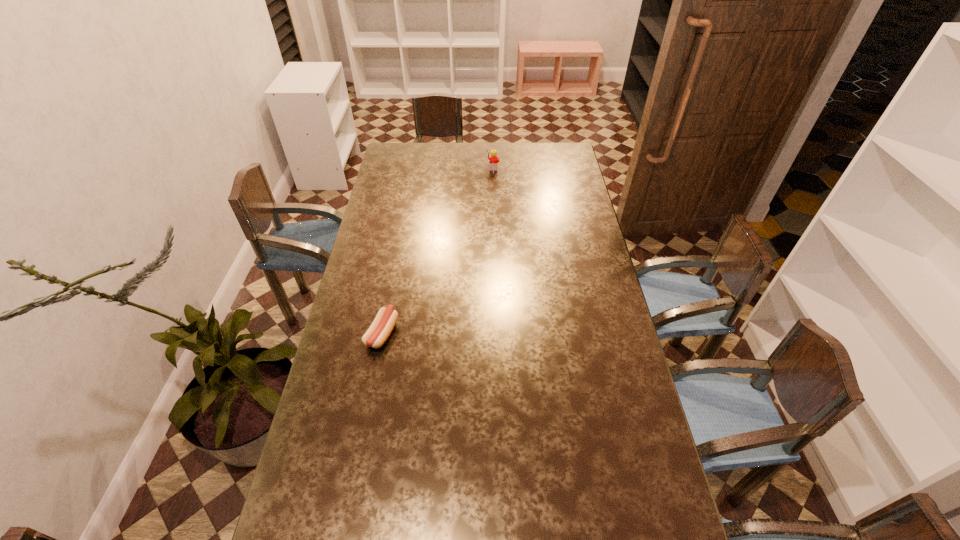
The height and width of the screenshot is (540, 960). I want to click on the taller object, so click(493, 159).

Identify the location of the farther object. This screenshot has height=540, width=960. (493, 159).

I want to click on sausage, so click(379, 331).

Where is `the nearer object`? The image size is (960, 540). the nearer object is located at coordinates (379, 331).

Where is `free spot located 0.400m in front of the right object with the accessory visible`? This screenshot has height=540, width=960. free spot located 0.400m in front of the right object with the accessory visible is located at coordinates pos(403,167).

This screenshot has width=960, height=540. I want to click on vacant space situated 0.230m in front of the right object with the accessory visible, so click(439, 167).

In order to click on vacant area located 0.160m in front of the right object with the accessory visible in this screenshot , I will do `click(453, 167)`.

Image resolution: width=960 pixels, height=540 pixels. What are the coordinates of `vacant region located 0.090m on the left of the left object` in the screenshot? It's located at (339, 333).

Where is `object that is at the far edge`? The width and height of the screenshot is (960, 540). object that is at the far edge is located at coordinates (493, 159).

Identify the location of object positioned at the left edge. This screenshot has height=540, width=960. (379, 331).